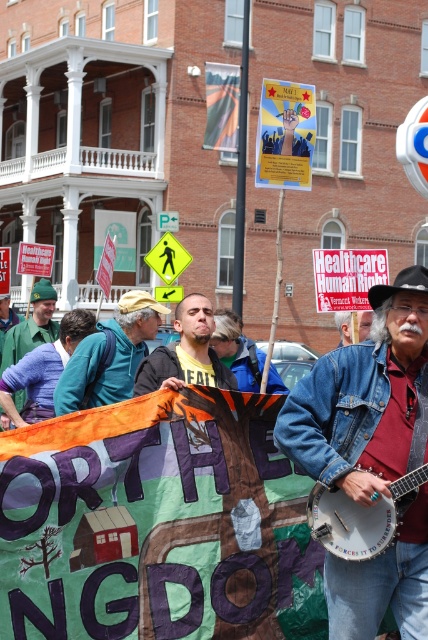
You are a photographer trying to capture the protest scene. You want to ensure both the green fabric banner at center and the denim jacket at lower right are clearly visible in your shot. Based on their sizes, which object should you focus on first to ensure they both fit in the frame?

The green fabric banner at center might be wider than denim jacket at lower right, so focusing on the larger object first would help ensure both fit in the frame.